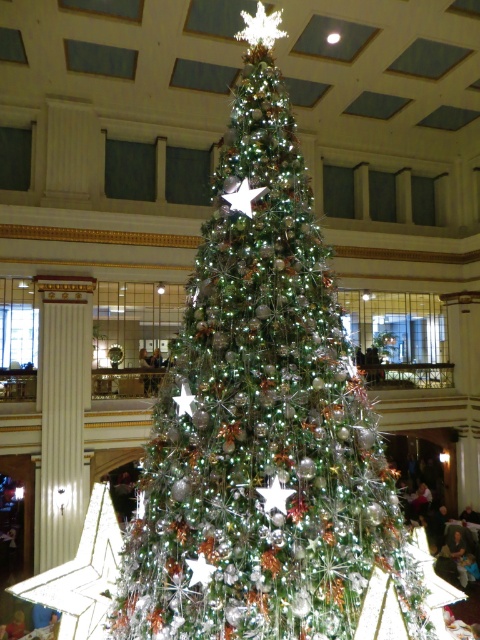
Question: Can you confirm if iridescent metallic christmas tree at center is positioned to the left of metallic silver star at center?

Choices:
 (A) yes
 (B) no

Answer: (B)

Question: Which point is farther from the camera taking this photo?

Choices:
 (A) (402, 547)
 (B) (236, 209)

Answer: (A)

Question: From the image, what is the correct spatial relationship of iridescent metallic christmas tree at center in relation to metallic silver star at center?

Choices:
 (A) right
 (B) left

Answer: (A)

Question: Is iridescent metallic christmas tree at center wider than metallic silver star at center?

Choices:
 (A) no
 (B) yes

Answer: (B)

Question: Among these objects, which one is nearest to the camera?

Choices:
 (A) iridescent metallic christmas tree at center
 (B) metallic silver star at center

Answer: (A)